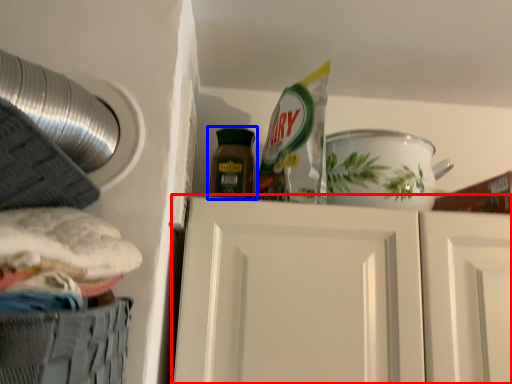
Question: Which object appears closest to the camera in this image, door (highlighted by a red box) or bottle (highlighted by a blue box)?

Choices:
 (A) door
 (B) bottle

Answer: (A)